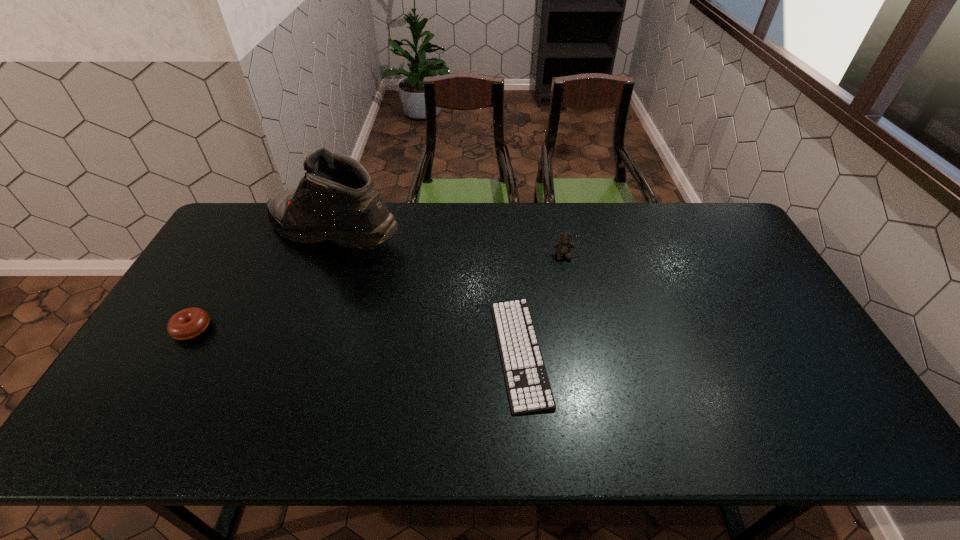
You are a GUI agent. You are given a task and a screenshot of the screen. Output one action in this format:
    pyautogui.click(x=<x>, y=<y>)
    Task: Click on the tallest object
    This screenshot has width=960, height=540.
    Given the screenshot: What is the action you would take?
    pyautogui.click(x=336, y=200)

Image resolution: width=960 pixels, height=540 pixels. I want to click on the third object from right to left, so click(x=336, y=200).

You are a GUI agent. You are given a task and a screenshot of the screen. Output one action in this format:
    pyautogui.click(x=<x>, y=<y>)
    Task: Click on the teddy bear
    
    Given the screenshot: What is the action you would take?
    pyautogui.click(x=563, y=247)

Identify the location of the rightmost object. The image size is (960, 540). (563, 247).

Image resolution: width=960 pixels, height=540 pixels. What are the coordinates of `the leftmost object` in the screenshot? It's located at (188, 323).

At what (x,y) coordinates should I click in order to perform the action: click on doughnut. Please return your answer as a coordinate pair (x, y). This screenshot has width=960, height=540. Looking at the image, I should click on (188, 323).

The image size is (960, 540). In order to click on the second object from right to left in this screenshot , I will do `click(529, 391)`.

Locate an element on the screen. The width and height of the screenshot is (960, 540). the shortest object is located at coordinates coord(529,391).

Where is `vacant space located on the right of the ski boot`? The height and width of the screenshot is (540, 960). vacant space located on the right of the ski boot is located at coordinates (419, 232).

Locate an element on the screen. The image size is (960, 540). free region located on the face of the rightmost object is located at coordinates pyautogui.click(x=568, y=281).